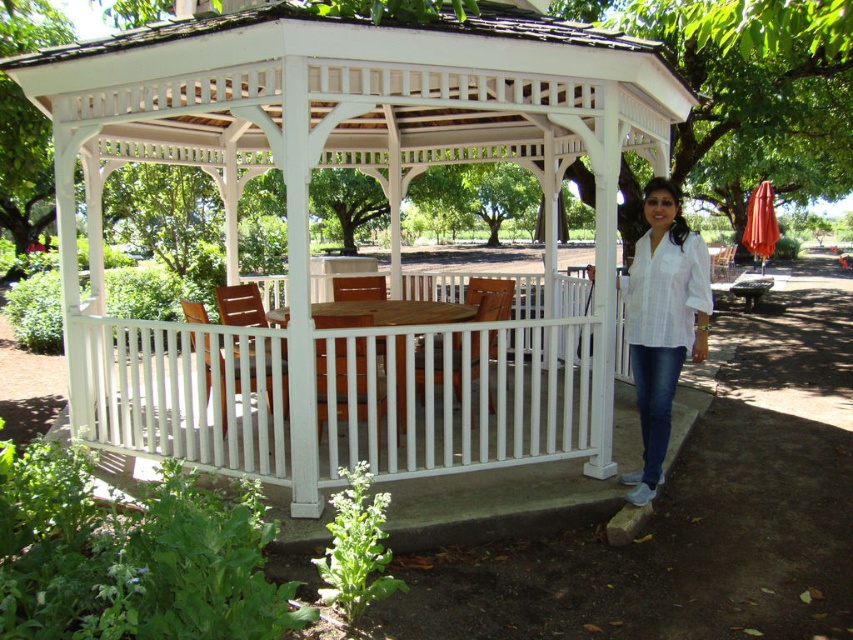
You are standing in front of the gazebo and want to determine the relative positions of two points marked in the image. Which point is closer to you, point (x=368, y=72) or point (x=642, y=403)?

Point (x=368, y=72) is closer to the viewer than point (x=642, y=403).

You are standing at the entrance of the gazebo and want to take a photo of both the point at coordinates point [345,339] and the point at coordinates point [703,282]. Which point should you focus on first to ensure both are in focus?

You should focus on the point at coordinates point [345,339] first because it is closer to the camera than the point at coordinates point [703,282]. This ensures both points will be in focus when taking the photo.